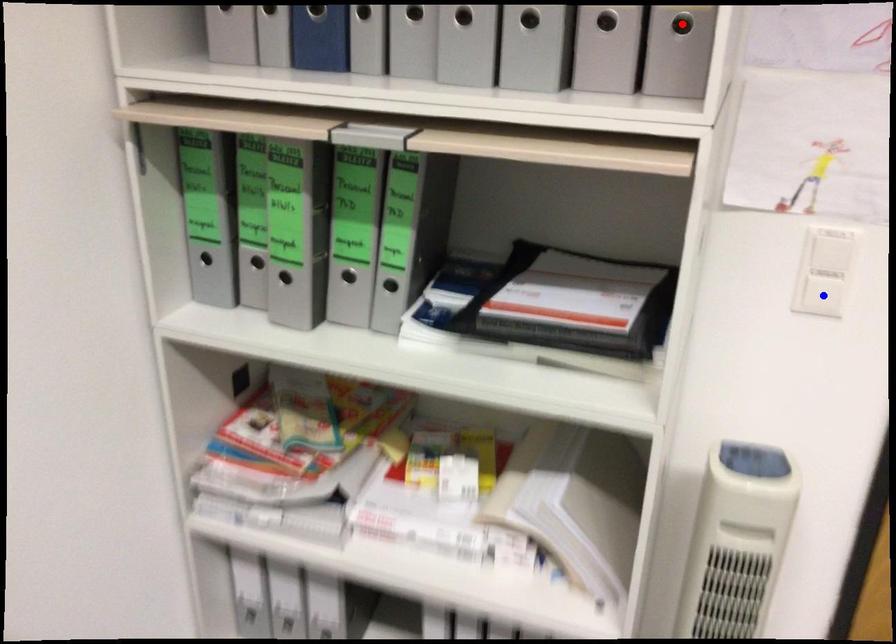
Question: Two points are marked on the image. Which point is closer to the camera?

Choices:
 (A) Blue point is closer.
 (B) Red point is closer.

Answer: (B)